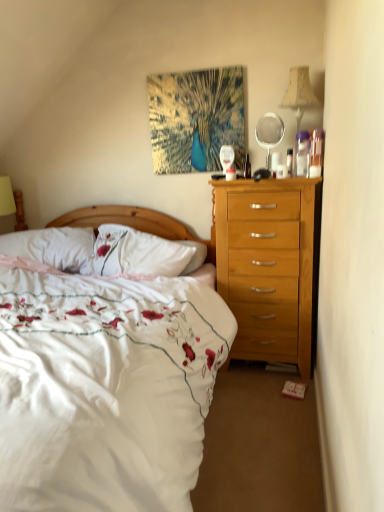
Question: Can you confirm if clear plastic mirror at upper right is shorter than white soft pillow at left?

Choices:
 (A) yes
 (B) no

Answer: (B)

Question: Is clear plastic mirror at upper right surrounding white soft pillow at left?

Choices:
 (A) no
 (B) yes

Answer: (A)

Question: Does clear plastic mirror at upper right have a larger size compared to white soft pillow at left?

Choices:
 (A) no
 (B) yes

Answer: (A)

Question: From the image's perspective, is clear plastic mirror at upper right under white soft pillow at left?

Choices:
 (A) no
 (B) yes

Answer: (A)

Question: Does clear plastic mirror at upper right appear on the right side of white soft pillow at left?

Choices:
 (A) no
 (B) yes

Answer: (B)

Question: From the image's perspective, relative to clear plastic mirror at upper right, is white soft pillow at left above or below?

Choices:
 (A) below
 (B) above

Answer: (A)

Question: In the image, is white soft pillow at left positioned in front of or behind clear plastic mirror at upper right?

Choices:
 (A) front
 (B) behind

Answer: (B)

Question: Is white soft pillow at left taller or shorter than clear plastic mirror at upper right?

Choices:
 (A) tall
 (B) short

Answer: (B)

Question: Considering the positions of white soft pillow at left and clear plastic mirror at upper right in the image, is white soft pillow at left wider or thinner than clear plastic mirror at upper right?

Choices:
 (A) thin
 (B) wide

Answer: (B)

Question: From their relative heights in the image, would you say clear plastic mirror at upper right is taller or shorter than white floral fabric bed at center?

Choices:
 (A) tall
 (B) short

Answer: (B)

Question: From the image's perspective, is clear plastic mirror at upper right located above or below white floral fabric bed at center?

Choices:
 (A) below
 (B) above

Answer: (B)

Question: Is point (258, 123) closer or farther from the camera than point (167, 359)?

Choices:
 (A) farther
 (B) closer

Answer: (A)

Question: Which is correct: clear plastic mirror at upper right is inside white floral fabric bed at center, or outside of it?

Choices:
 (A) outside
 (B) inside

Answer: (A)

Question: From a real-world perspective, is white floral fabric bed at center positioned above or below beige fabric lampshade at upper right?

Choices:
 (A) below
 (B) above

Answer: (A)

Question: From the image's perspective, is white floral fabric bed at center located above or below beige fabric lampshade at upper right?

Choices:
 (A) above
 (B) below

Answer: (B)